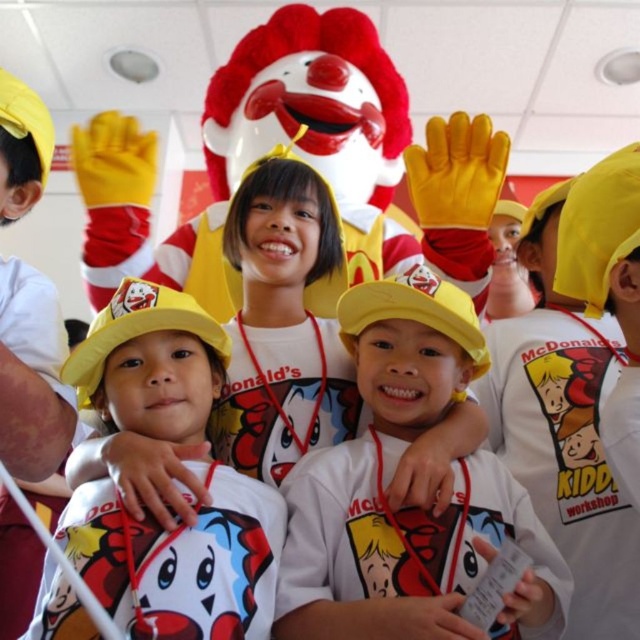
Based on the photo, does yellow matte cap at center come behind yellow matte hat at center?

That is True.

Can you confirm if yellow matte cap at center is positioned below yellow matte hat at center?

No.

Identify the location of yellow matte cap at center. (406, 509).